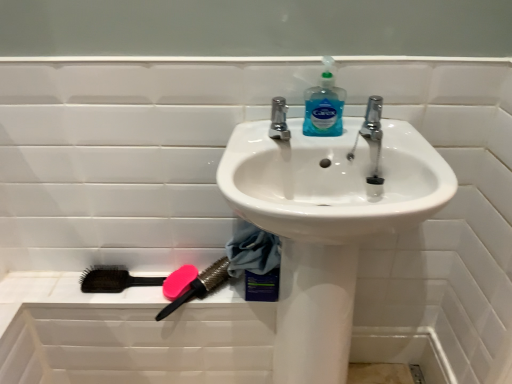
Where is `vacant space that is to the left of translucent plastic soap dispenser at upper center`? vacant space that is to the left of translucent plastic soap dispenser at upper center is located at coordinates (263, 128).